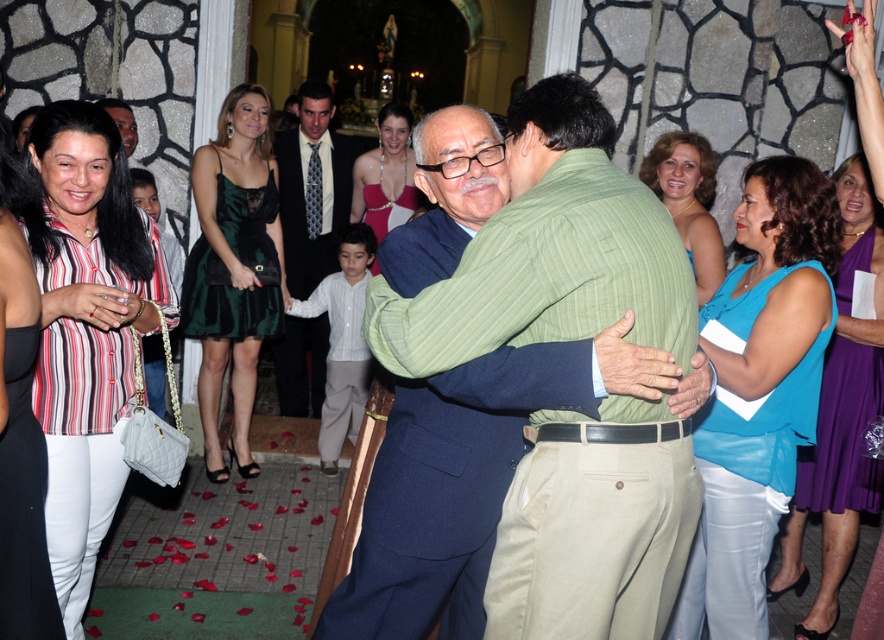
The height and width of the screenshot is (640, 884). What do you see at coordinates (759, 392) in the screenshot?
I see `blue fabric top at center` at bounding box center [759, 392].

The image size is (884, 640). I want to click on blue fabric top at center, so click(759, 392).

What do you see at coordinates (759, 392) in the screenshot? The image size is (884, 640). I see `blue fabric top at center` at bounding box center [759, 392].

The image size is (884, 640). What are the coordinates of `blue fabric top at center` in the screenshot? It's located at (759, 392).

Measure the distance between point (79, 394) and camera.

2.50 meters

Can you confirm if striped cotton blouse at left is positioned above light blue shirt at center?

Incorrect, striped cotton blouse at left is not positioned above light blue shirt at center.

Between point (136, 246) and point (288, 337), which one is positioned behind?

The point (288, 337) is more distant.

Identify the location of striped cotton blouse at left. This screenshot has width=884, height=640. (88, 330).

Which is below, striped cotton blouse at left or purple satin dress at center?

purple satin dress at center is lower down.

Can you confirm if striped cotton blouse at left is bigger than purple satin dress at center?

No.

This screenshot has height=640, width=884. I want to click on striped cotton blouse at left, so click(88, 330).